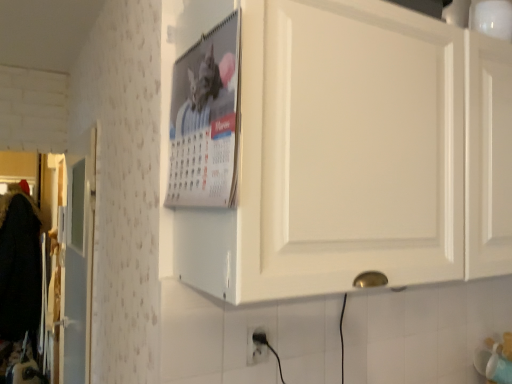
Question: Does metallic silver calendar at upper center have a lesser height compared to white plastic electric outlet at lower center?

Choices:
 (A) no
 (B) yes

Answer: (A)

Question: Is metallic silver calendar at upper center aimed at white plastic electric outlet at lower center?

Choices:
 (A) yes
 (B) no

Answer: (B)

Question: From the image's perspective, is metallic silver calendar at upper center located above white plastic electric outlet at lower center?

Choices:
 (A) yes
 (B) no

Answer: (A)

Question: Is metallic silver calendar at upper center far away from white plastic electric outlet at lower center?

Choices:
 (A) no
 (B) yes

Answer: (A)

Question: Is metallic silver calendar at upper center taller than white plastic electric outlet at lower center?

Choices:
 (A) no
 (B) yes

Answer: (B)

Question: Is point (324, 29) closer or farther from the camera than point (248, 347)?

Choices:
 (A) closer
 (B) farther

Answer: (A)

Question: Relative to white plastic electric outlet at lower center, is white matte cabinet at upper center in front or behind?

Choices:
 (A) front
 (B) behind

Answer: (A)

Question: Is white matte cabinet at upper center spatially inside white plastic electric outlet at lower center, or outside of it?

Choices:
 (A) inside
 (B) outside

Answer: (B)

Question: Is white matte cabinet at upper center taller or shorter than white plastic electric outlet at lower center?

Choices:
 (A) short
 (B) tall

Answer: (B)

Question: Does point (233, 145) appear closer or farther from the camera than point (266, 59)?

Choices:
 (A) closer
 (B) farther

Answer: (A)

Question: Relative to white matte cabinet at upper center, is metallic silver calendar at upper center in front or behind?

Choices:
 (A) behind
 (B) front

Answer: (A)

Question: Is metallic silver calendar at upper center bigger or smaller than white matte cabinet at upper center?

Choices:
 (A) small
 (B) big

Answer: (A)

Question: From the image's perspective, is metallic silver calendar at upper center located above or below white matte cabinet at upper center?

Choices:
 (A) below
 (B) above

Answer: (B)

Question: From a real-world perspective, is white plastic electric outlet at lower center physically located above or below metallic silver calendar at upper center?

Choices:
 (A) above
 (B) below

Answer: (B)

Question: Considering their positions, is white plastic electric outlet at lower center located in front of or behind metallic silver calendar at upper center?

Choices:
 (A) behind
 (B) front

Answer: (A)